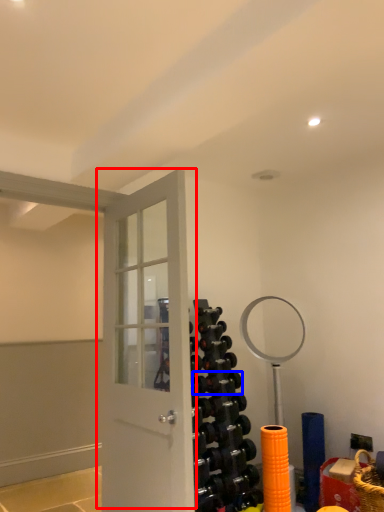
Question: Among these objects, which one is farthest to the camera, door (highlighted by a red box) or dumbbell (highlighted by a blue box)?

Choices:
 (A) door
 (B) dumbbell

Answer: (B)